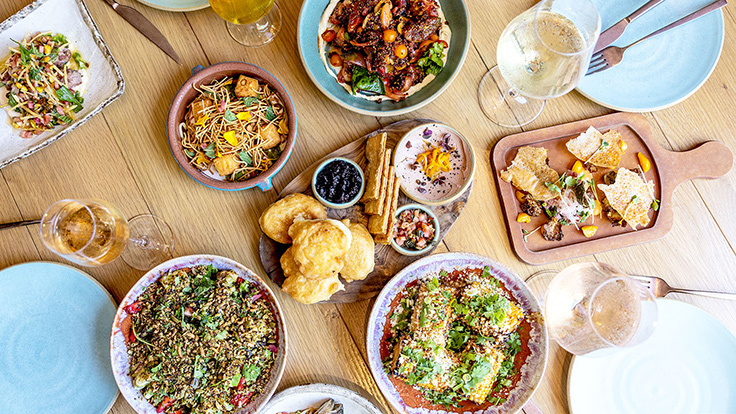
Find the location of a particular element. blueish green plate is located at coordinates (59, 317), (180, 2), (656, 73).